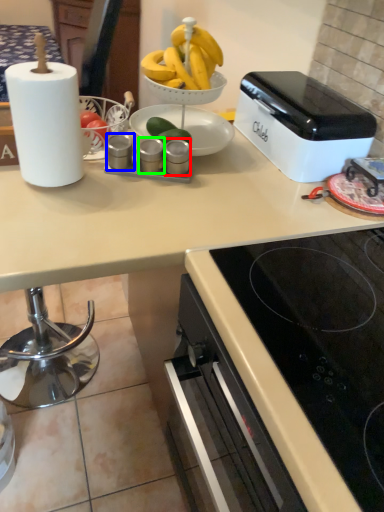
Question: Which object is positioned closest to appliance (highlighted by a red box)? Select from appliance (highlighted by a blue box) and appliance (highlighted by a green box).

Choices:
 (A) appliance
 (B) appliance

Answer: (B)